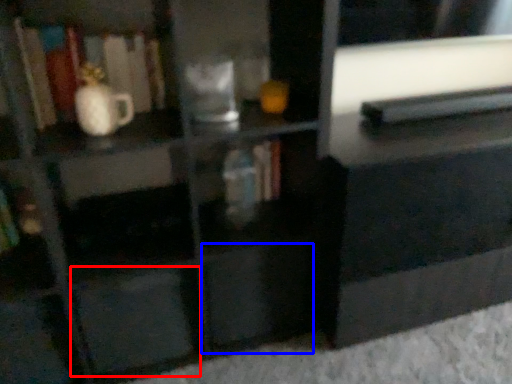
Question: Which object appears farthest to the camera in this image, drawer (highlighted by a red box) or drawer (highlighted by a blue box)?

Choices:
 (A) drawer
 (B) drawer

Answer: (B)